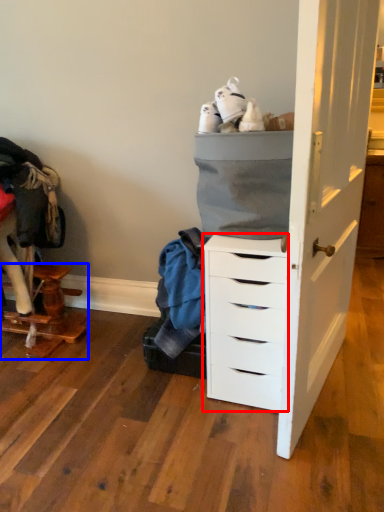
Question: Among these objects, which one is nearest to the camera, chest of drawers (highlighted by a red box) or furniture (highlighted by a blue box)?

Choices:
 (A) chest of drawers
 (B) furniture

Answer: (A)